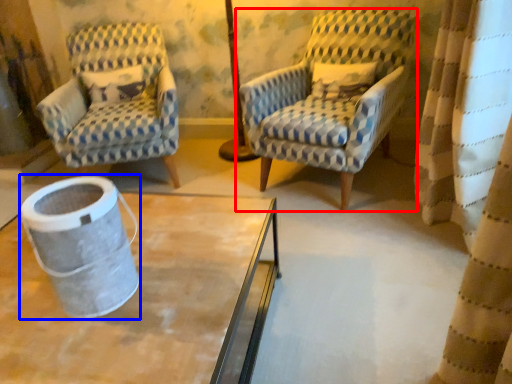
Question: Which of the following is the farthest to the observer, chair (highlighted by a red box) or gray (highlighted by a blue box)?

Choices:
 (A) chair
 (B) gray

Answer: (A)